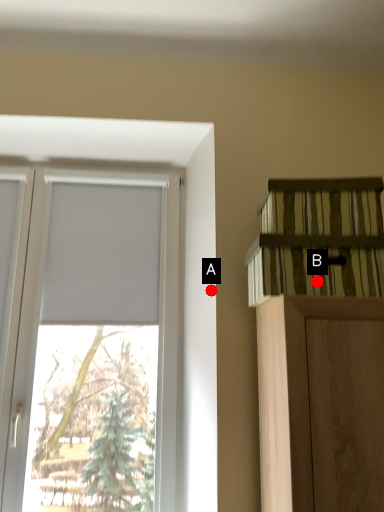
Question: Two points are circled on the image, labeled by A and B beside each circle. Which point is farther from the camera taking this photo?

Choices:
 (A) A is further
 (B) B is further

Answer: (A)